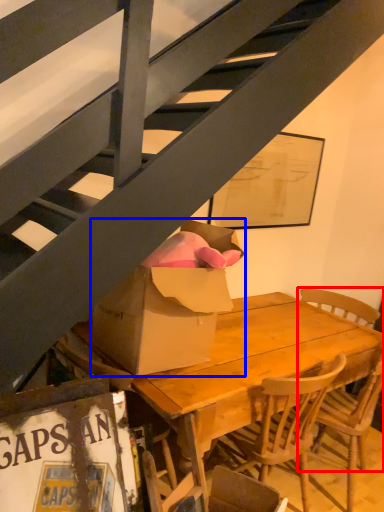
Question: Among these objects, which one is farthest to the camera, chair (highlighted by a red box) or box (highlighted by a blue box)?

Choices:
 (A) chair
 (B) box

Answer: (A)